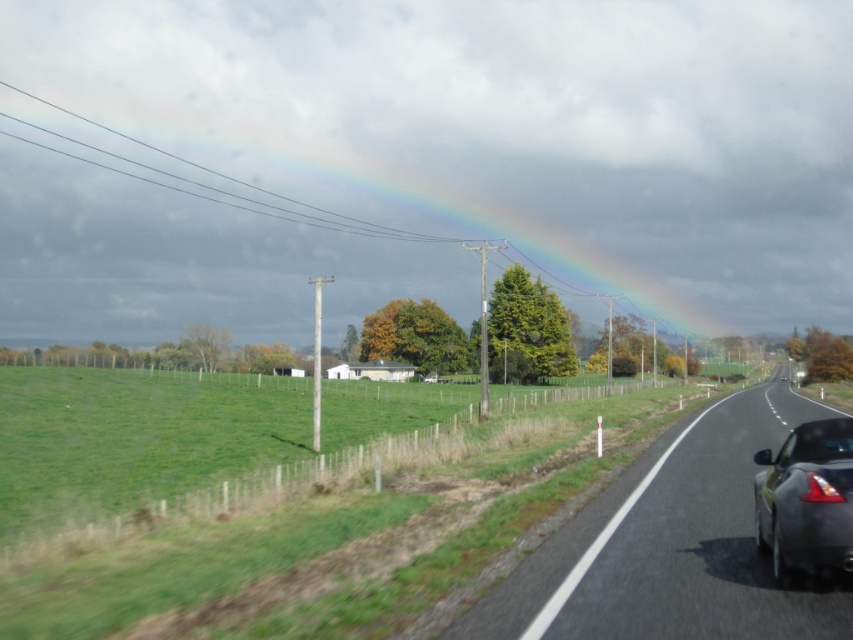
Question: Among these objects, which one is nearest to the camera?

Choices:
 (A) rainbow at upper center
 (B) transparent glass car window at right
 (C) asphalt road at center

Answer: (C)

Question: Which point is closer to the camera?

Choices:
 (A) (747, 400)
 (B) (805, 445)
 (C) (154, 170)

Answer: (B)

Question: Can you confirm if asphalt road at center is thinner than shiny metallic car at right?

Choices:
 (A) no
 (B) yes

Answer: (A)

Question: Which point appears farthest from the camera in this image?

Choices:
 (A) (828, 435)
 (B) (136, 173)

Answer: (B)

Question: Is asphalt road at center bigger than transparent glass car window at right?

Choices:
 (A) no
 (B) yes

Answer: (B)

Question: Is asphalt road at center smaller than rainbow at upper center?

Choices:
 (A) yes
 (B) no

Answer: (A)